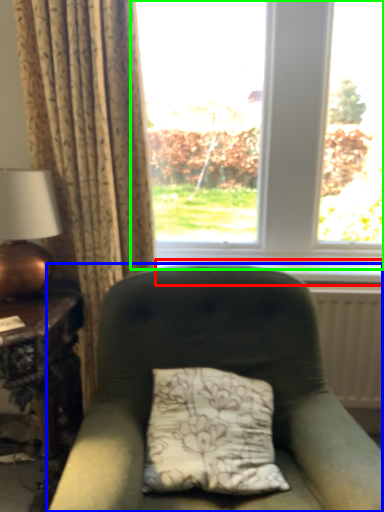
Question: Which object is the farthest from window sill (highlighted by a red box)? Choose among these: chair (highlighted by a blue box) or window (highlighted by a green box).

Choices:
 (A) chair
 (B) window

Answer: (A)